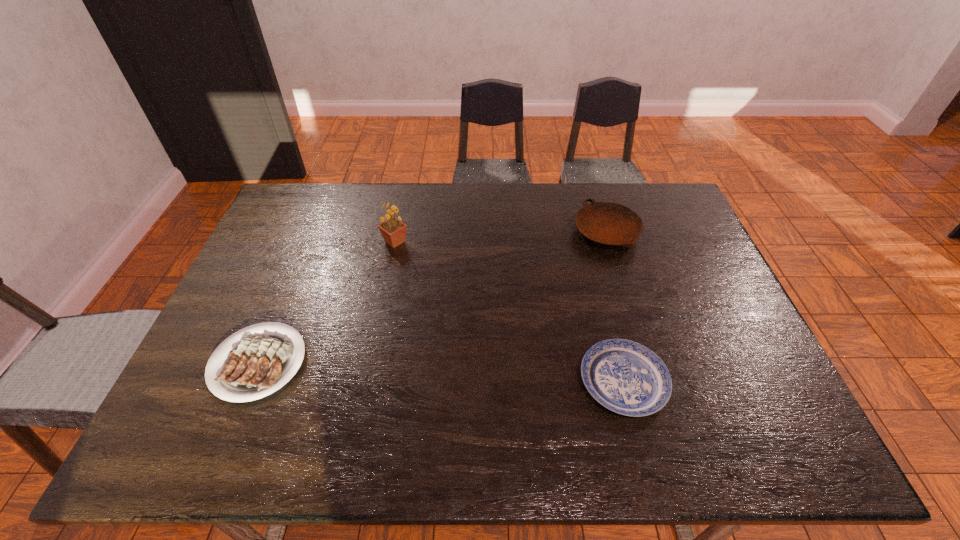
You are a GUI agent. You are given a task and a screenshot of the screen. Output one action in this format:
    pyautogui.click(x=<x>, y=<y>)
    Task: Click on the object that is at the left edge
    
    Given the screenshot: What is the action you would take?
    pyautogui.click(x=253, y=367)

Where is `vacant space at the far edge`? The width and height of the screenshot is (960, 540). vacant space at the far edge is located at coordinates (496, 215).

Image resolution: width=960 pixels, height=540 pixels. I want to click on vacant space at the near edge of the desktop, so click(x=451, y=446).

This screenshot has width=960, height=540. I want to click on blank space at the left edge, so pyautogui.click(x=299, y=267).

The height and width of the screenshot is (540, 960). In the image, there is a desktop. Find the location of `vacant space at the right edge`. vacant space at the right edge is located at coordinates (675, 277).

Where is `vacant area between the leftmost plate and the tallest object`? vacant area between the leftmost plate and the tallest object is located at coordinates (326, 302).

The height and width of the screenshot is (540, 960). In order to click on free space between the leftmost object and the tallest object in this screenshot , I will do `click(326, 302)`.

Find the location of a particular element. This screenshot has height=540, width=960. empty space between the farthest plate and the tallest object is located at coordinates (500, 237).

The width and height of the screenshot is (960, 540). I want to click on vacant space that's between the tallest object and the third shortest object, so click(x=500, y=237).

Locate an element on the screen. This screenshot has width=960, height=540. the third closest object relative to the leftmost plate is located at coordinates (607, 223).